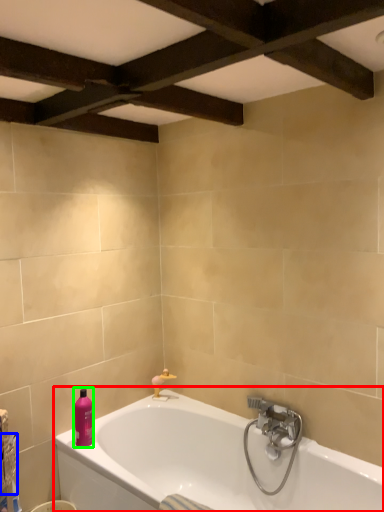
Question: Estimate the real-world distances between objects in this image. Which object is closer to bathtub (highlighted by a red box), basket (highlighted by a blue box) or toiletry (highlighted by a green box)?

Choices:
 (A) basket
 (B) toiletry

Answer: (B)